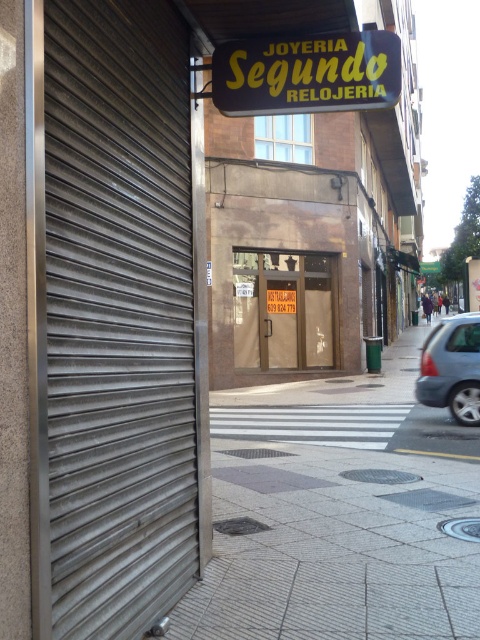
Question: Which point is closer to the camera taking this photo?

Choices:
 (A) (376, 60)
 (B) (67, 96)

Answer: (B)

Question: Is metallic gray garage door at left wider than yellow plastic sign at upper center?

Choices:
 (A) yes
 (B) no

Answer: (B)

Question: Estimate the real-world distances between objects in this image. Which object is closer to the brown matte door at center?

Choices:
 (A) silver metallic car at right
 (B) metallic gray garage door at left
 (C) gray concrete pavement at center
 (D) yellow plastic sign at upper center

Answer: (C)

Question: Which point is farther to the camera?

Choices:
 (A) (54, 557)
 (B) (238, 451)

Answer: (B)

Question: Is yellow plastic sign at upper center to the right of silver metallic car at right from the viewer's perspective?

Choices:
 (A) yes
 (B) no

Answer: (B)

Question: Does gray concrete pavement at center have a smaller size compared to yellow plastic sign at upper center?

Choices:
 (A) yes
 (B) no

Answer: (B)